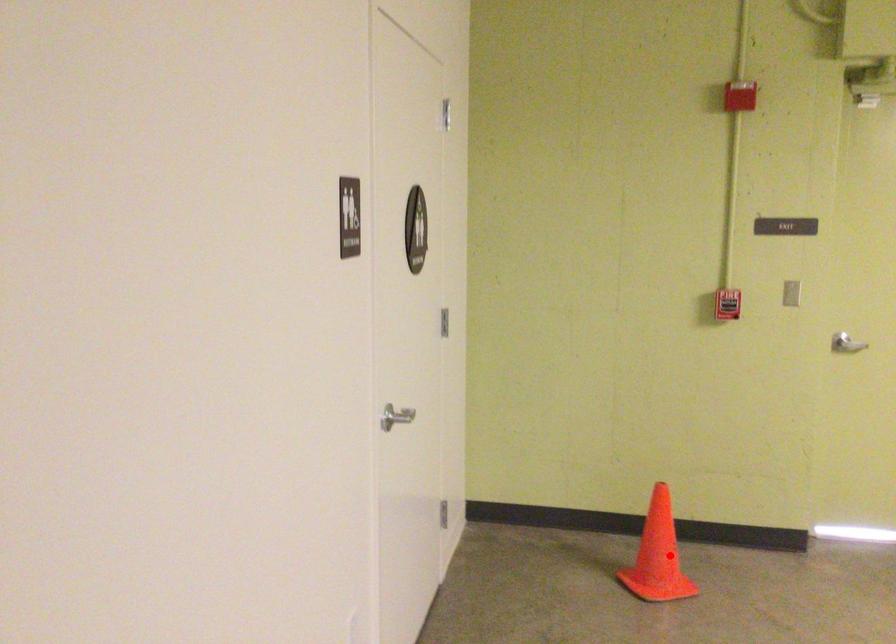
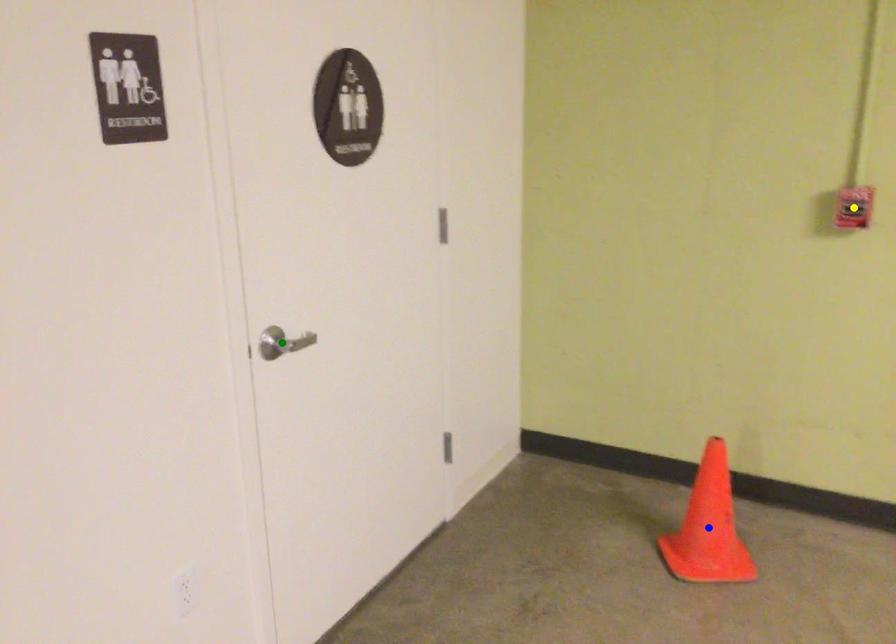
Question: I am providing you with two images of the same scene from different viewpoints. A red point is marked on the first image. You are given multiple points on the second image. Can you choose the point in image 2 that corresponds to the point in image 1?

Choices:
 (A) green point
 (B) yellow point
 (C) blue point

Answer: (C)